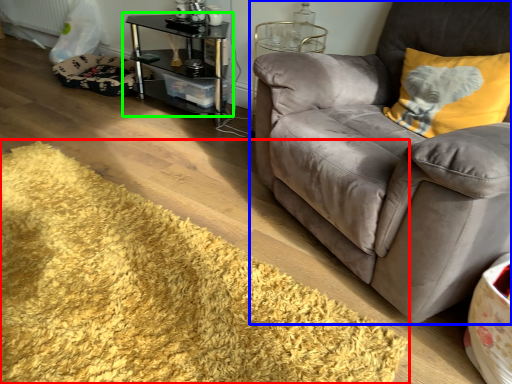
Question: Based on their relative distances, which object is nearer to mat (highlighted by a red box)? Choose from studio couch (highlighted by a blue box) and table (highlighted by a green box).

Choices:
 (A) studio couch
 (B) table

Answer: (A)